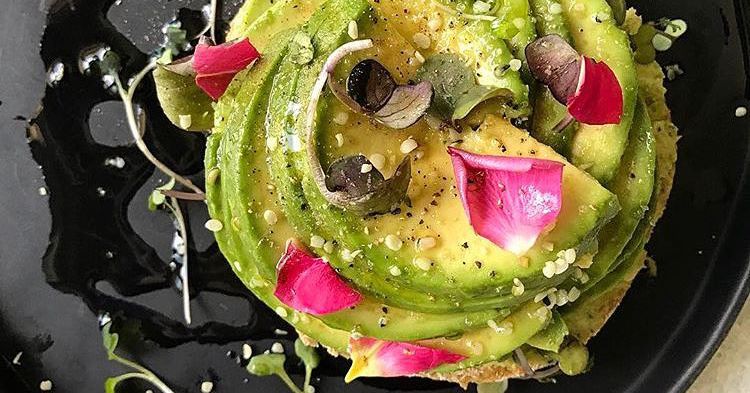
Find the location of a particular element. Image resolution: width=750 pixels, height=393 pixels. plate is located at coordinates (67, 311).